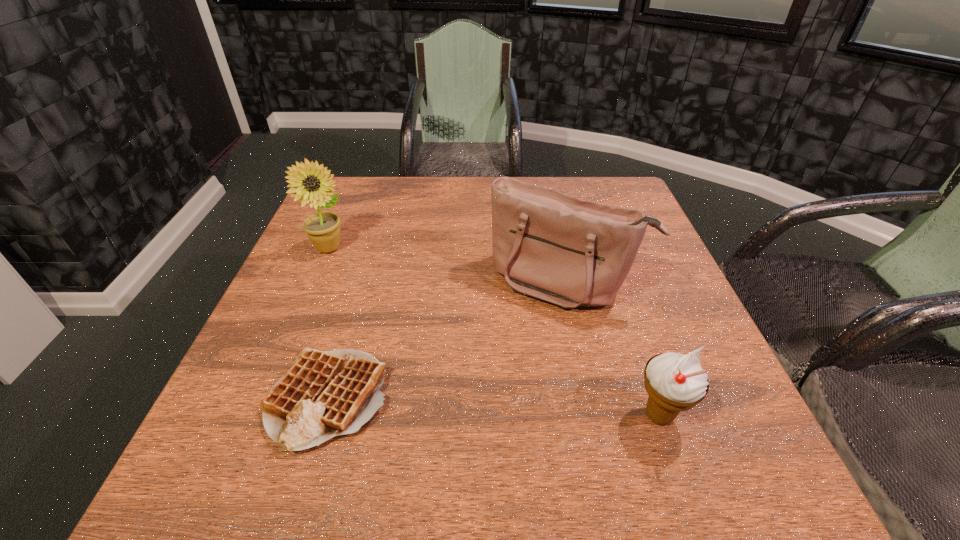
Identify the location of empty space between the shoulder bag and the sunflower. (446, 265).

You are a GUI agent. You are given a task and a screenshot of the screen. Output one action in this format:
    pyautogui.click(x=<x>, y=<y>)
    Task: Click on the empty space between the shoulder bag and the sunflower
    The image size is (960, 540).
    Given the screenshot: What is the action you would take?
    pos(446,265)

Where is `empty location between the sunflower and the second shortest object`? empty location between the sunflower and the second shortest object is located at coordinates (494, 332).

Identify the location of vacant space in between the sunflower and the second shortest object. (494, 332).

At what (x,y) coordinates should I click in order to perform the action: click on vacant space that's between the waffle and the sunflower. Please return your answer as a coordinate pair (x, y). The width and height of the screenshot is (960, 540). Looking at the image, I should click on (329, 323).

Locate an element on the screen. The width and height of the screenshot is (960, 540). object that is the third closest one to the third tallest object is located at coordinates (323, 229).

Point out which object is positioned as the third nearest to the shortest object. Please provide its 2D coordinates. Your answer should be formatted as a tuple, i.e. [(x, y)], where the tuple contains the x and y coordinates of a point satisfying the conditions above.

[(675, 382)]

This screenshot has height=540, width=960. Find the location of `vacant area that satisfies the following two spatial constraints: 1. on the front side of the third tallest object; 2. on the right side of the sunflower`. vacant area that satisfies the following two spatial constraints: 1. on the front side of the third tallest object; 2. on the right side of the sunflower is located at coordinates (260, 415).

This screenshot has width=960, height=540. Find the location of `free space that satisfies the following two spatial constraints: 1. on the front side of the icecream; 2. on the left side of the shoulder bag`. free space that satisfies the following two spatial constraints: 1. on the front side of the icecream; 2. on the left side of the shoulder bag is located at coordinates coord(591,415).